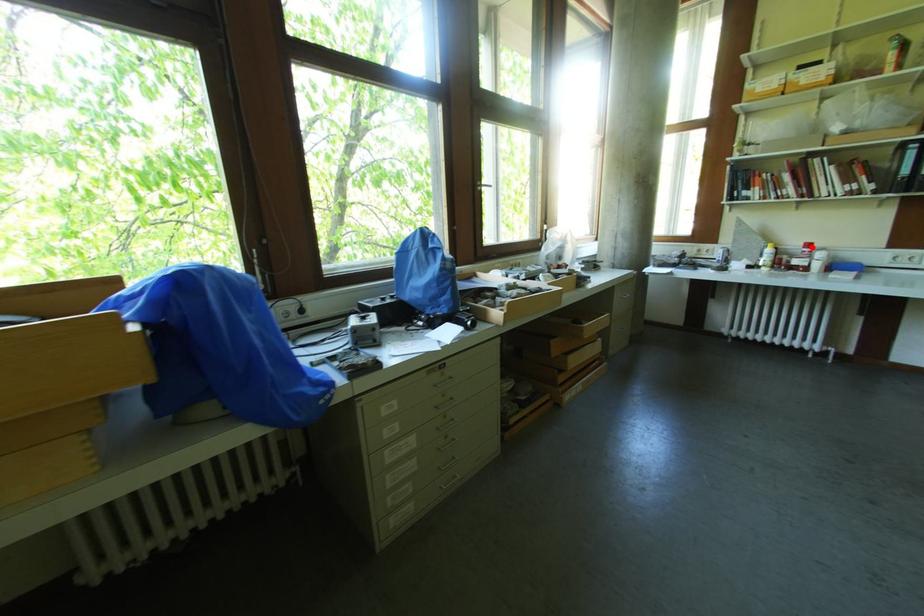
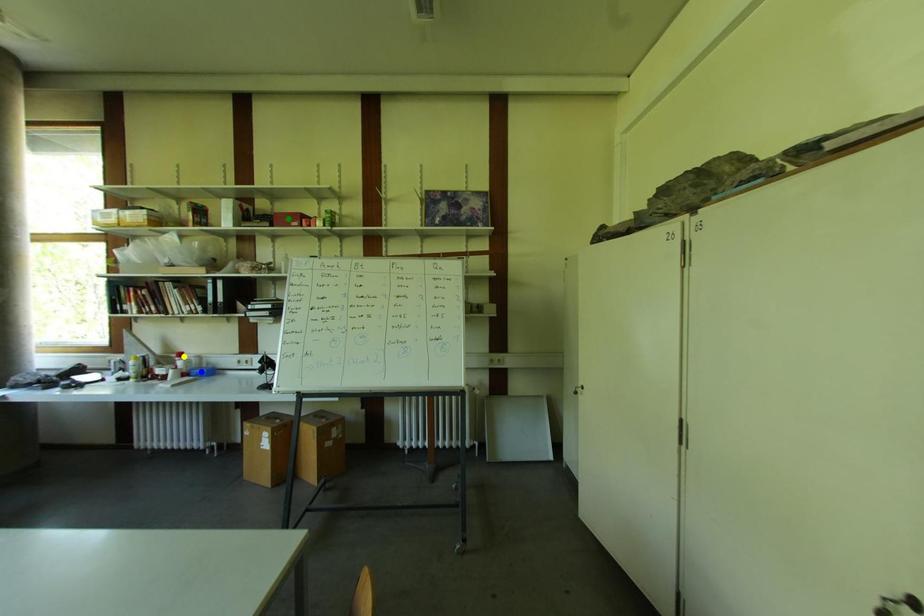
Question: I am providing you with two images of the same scene from different viewpoints. A red point is marked on the first image. You are given multiple points on the second image. Can you choose the point in image 2 that corresponds to the point in image 1?

Choices:
 (A) green point
 (B) yellow point
 (C) blue point

Answer: (B)